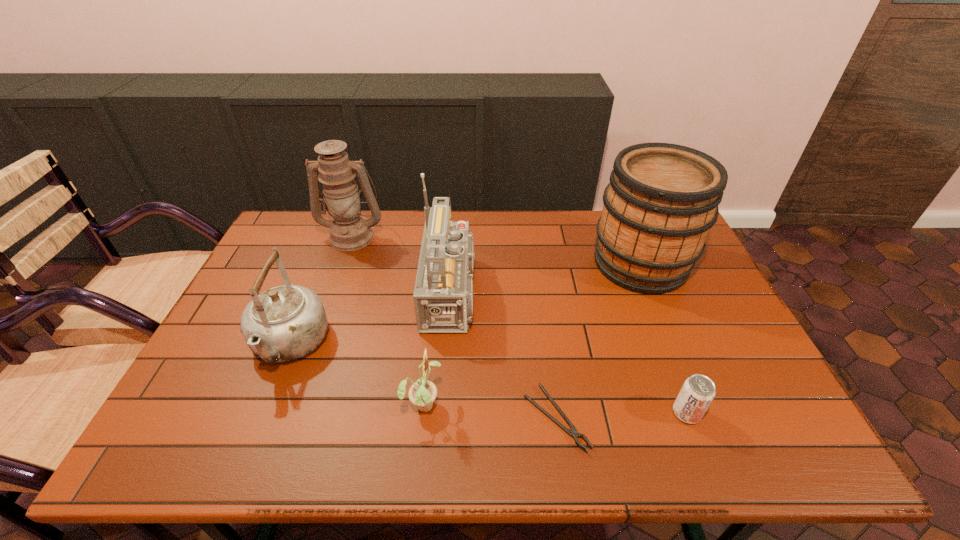
Locate an element on the screen. oil lamp is located at coordinates (349, 231).

This screenshot has width=960, height=540. I want to click on cider, so click(662, 199).

Image resolution: width=960 pixels, height=540 pixels. What are the coordinates of `radio receiver` in the screenshot? It's located at (443, 294).

Image resolution: width=960 pixels, height=540 pixels. I want to click on the fourth tallest object, so click(x=285, y=323).

Locate an element on the screen. sunflower is located at coordinates (422, 393).

At what (x,y) coordinates should I click in order to perform the action: click on soda can. Please return your answer as a coordinate pair (x, y). This screenshot has width=960, height=540. Looking at the image, I should click on (698, 391).

At what (x,y) coordinates should I click in order to perform the action: click on the third object from right to left. Please return your answer as a coordinate pair (x, y). Looking at the image, I should click on (573, 432).

I want to click on tongs, so click(573, 432).

Identify the location of vacant region located on the front of the oil lamp. (337, 280).

Locate an element on the screen. The width and height of the screenshot is (960, 540). vacant space located 0.330m on the front of the cider is located at coordinates (695, 394).